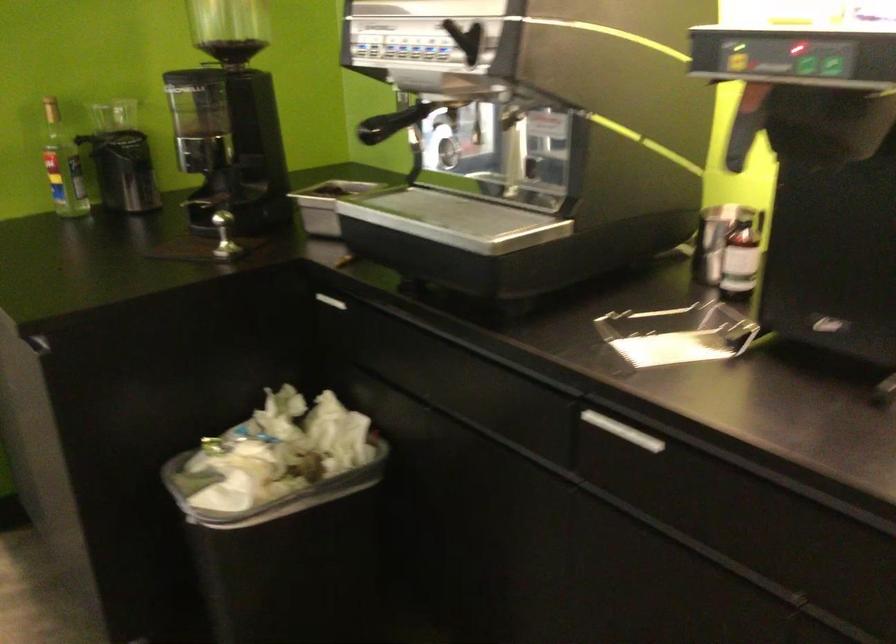
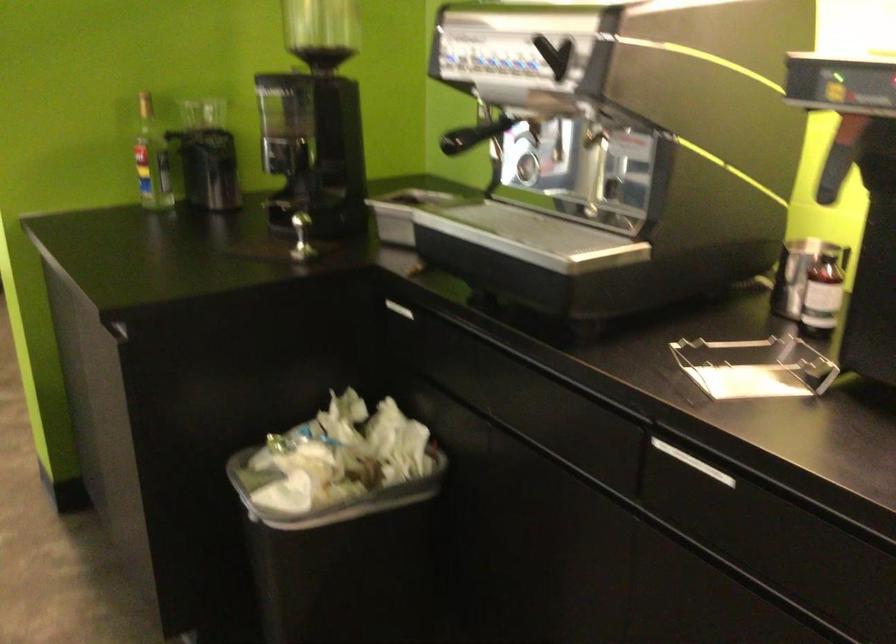
In the second image, find the point that corresponds to the point at 624,431 in the first image.

(693, 462)